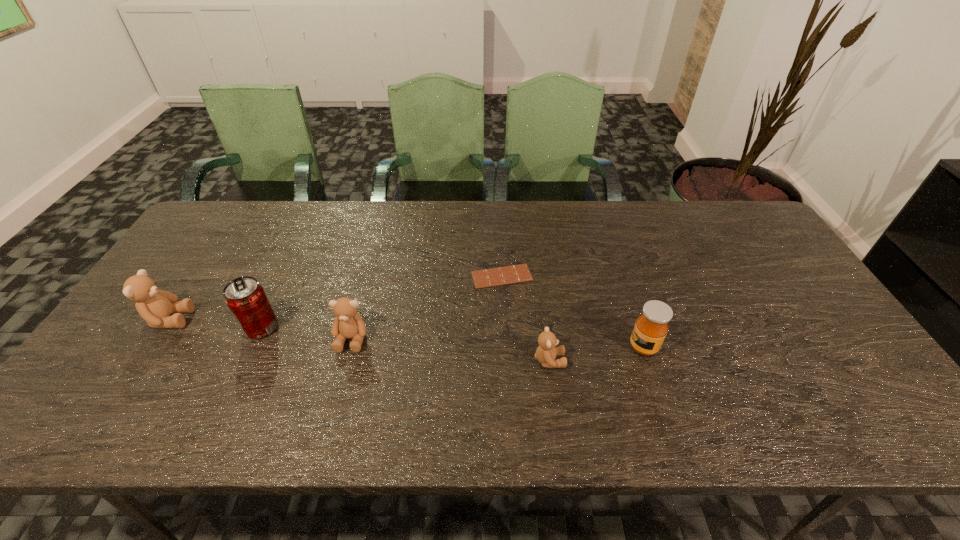
This screenshot has width=960, height=540. I want to click on free space located on the front-facing side of the leftmost teddy bear, so click(213, 319).

You are a GUI agent. You are given a task and a screenshot of the screen. Output one action in this format:
    pyautogui.click(x=<x>, y=<y>)
    Task: Click on the vacant region located 0.080m on the front-facing side of the second tallest teddy bear
    The width and height of the screenshot is (960, 540).
    Given the screenshot: What is the action you would take?
    pyautogui.click(x=340, y=382)

Locate an element on the screen. The image size is (960, 540). vacant space situated 0.160m on the front-facing side of the shortest teddy bear is located at coordinates (630, 360).

At what (x,y) coordinates should I click in order to perform the action: click on free location located 0.220m on the back of the fifth object from right to left. Please return your answer as a coordinate pair (x, y). Looking at the image, I should click on (292, 260).

I want to click on vacant area situated on the left of the chocolate bar, so click(x=440, y=276).

The image size is (960, 540). I want to click on vacant position located 0.220m on the front-facing side of the rightmost object, so click(x=540, y=347).

At what (x,y) coordinates should I click in order to perform the action: click on vacant space located on the front-facing side of the rightmost object. Please return your answer as a coordinate pair (x, y). This screenshot has height=540, width=960. Looking at the image, I should click on (485, 347).

At what (x,y) coordinates should I click in order to perform the action: click on free space located 0.140m on the front-facing side of the rightmost object. Please return your answer as a coordinate pair (x, y). This screenshot has width=960, height=540. Looking at the image, I should click on (573, 347).

What are the coordinates of `object that is at the near edge` in the screenshot? It's located at (546, 352).

Where is `object positioned at the left edge`? The height and width of the screenshot is (540, 960). object positioned at the left edge is located at coordinates (155, 306).